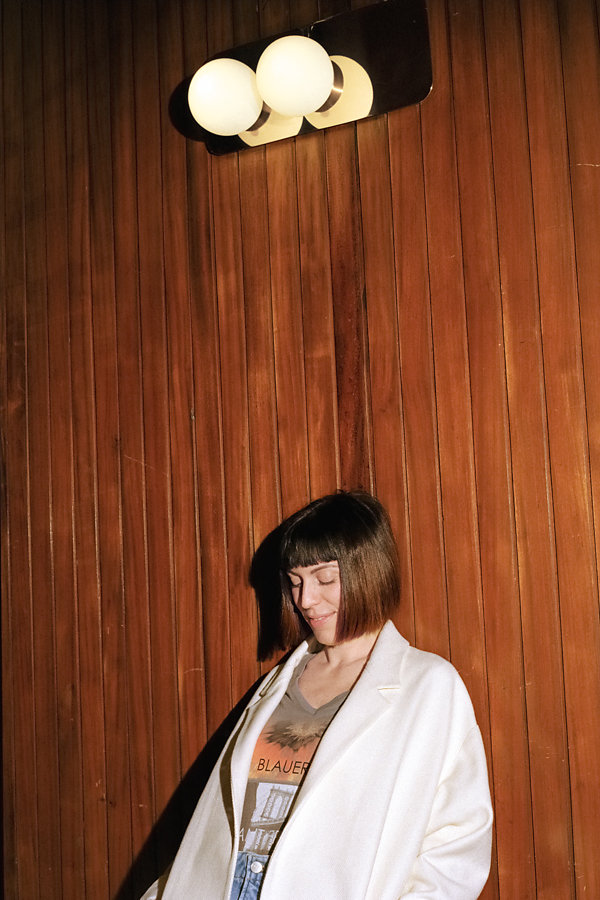
Where is `right light bulb`? Image resolution: width=600 pixels, height=900 pixels. right light bulb is located at coordinates (292, 67).